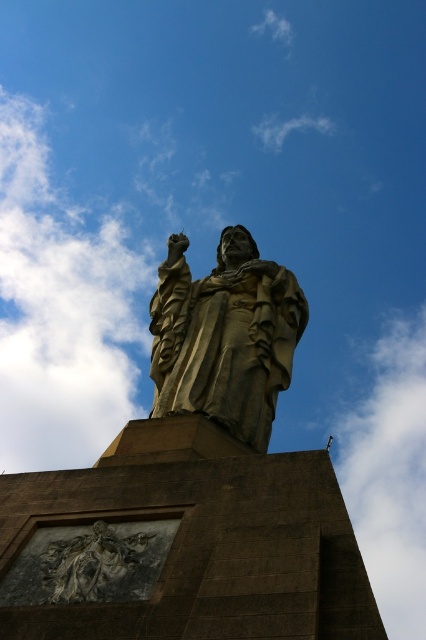
Question: From the image, what is the correct spatial relationship of white fluffy cloud at upper left in relation to rustic stone carving at lower left?

Choices:
 (A) right
 (B) left

Answer: (B)

Question: Which object is positioned closest to the rustic stone carving at lower left?

Choices:
 (A) gold/statue at center
 (B) white fluffy cloud at upper left
 (C) white fluffy cloud at upper right

Answer: (A)

Question: Which object is positioned farthest from the white fluffy cloud at upper left?

Choices:
 (A) rustic stone carving at lower left
 (B) white fluffy cloud at upper right

Answer: (A)

Question: Is white fluffy cloud at upper right below rustic stone carving at lower left?

Choices:
 (A) yes
 (B) no

Answer: (A)

Question: Is white fluffy cloud at upper left below gold/statue at center?

Choices:
 (A) no
 (B) yes

Answer: (A)

Question: Among these points, which one is nearest to the camera?

Choices:
 (A) (365, 483)
 (B) (25, 384)

Answer: (B)